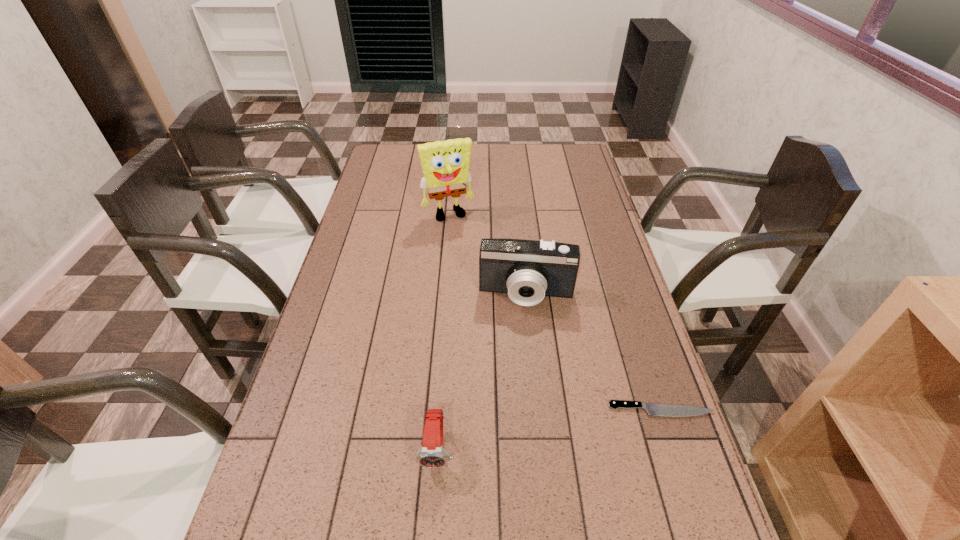
Find the location of a particular element. This screenshot has height=540, width=960. the nearest object is located at coordinates (431, 454).

At what (x,y) coordinates should I click in order to perform the action: click on watch. Please return your answer as a coordinate pair (x, y). Looking at the image, I should click on (431, 454).

The width and height of the screenshot is (960, 540). I want to click on the shortest object, so click(652, 409).

The width and height of the screenshot is (960, 540). What are the coordinates of `the rightmost object` in the screenshot? It's located at (652, 409).

The image size is (960, 540). Identify the location of the second farthest object. (528, 270).

Find the location of a particular element. the third object from left to right is located at coordinates (528, 270).

The image size is (960, 540). I want to click on the farthest object, so click(x=445, y=164).

The width and height of the screenshot is (960, 540). What are the coordinates of `the tallest object` in the screenshot? It's located at (445, 164).

The image size is (960, 540). I want to click on free space located 0.050m on the face of the watch, so click(434, 498).

This screenshot has height=540, width=960. Find the location of `vacant space positioned on the back of the rightmost object`. vacant space positioned on the back of the rightmost object is located at coordinates (626, 300).